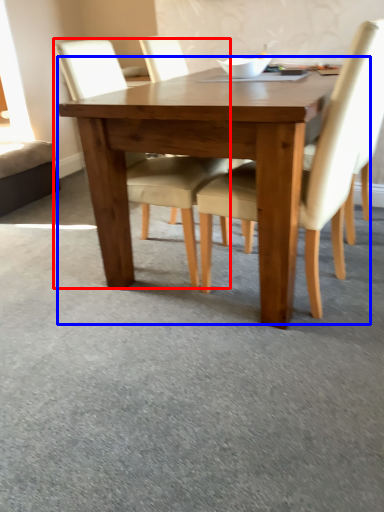
Question: Among these objects, which one is farthest to the camera, chair (highlighted by a red box) or kitchen & dining room table (highlighted by a blue box)?

Choices:
 (A) chair
 (B) kitchen & dining room table

Answer: (A)